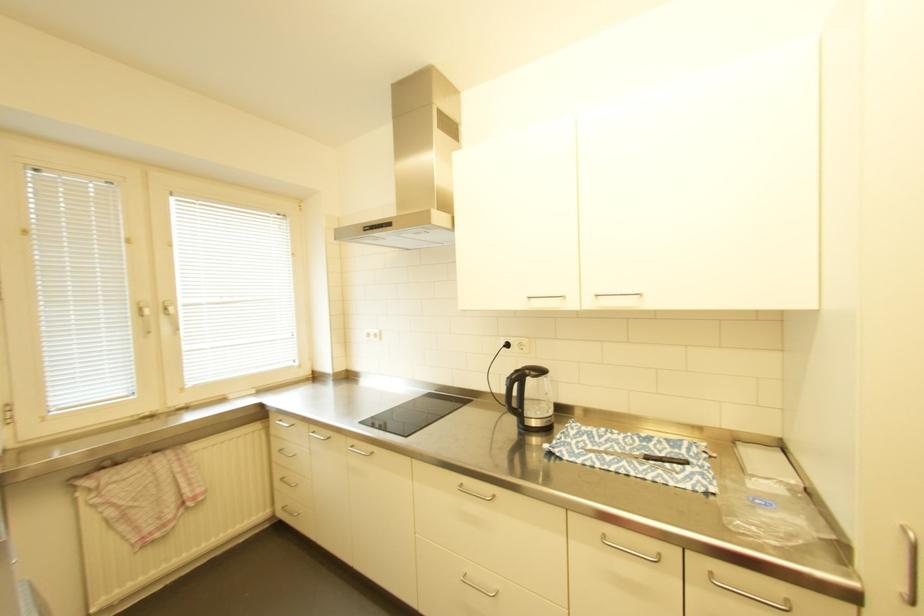
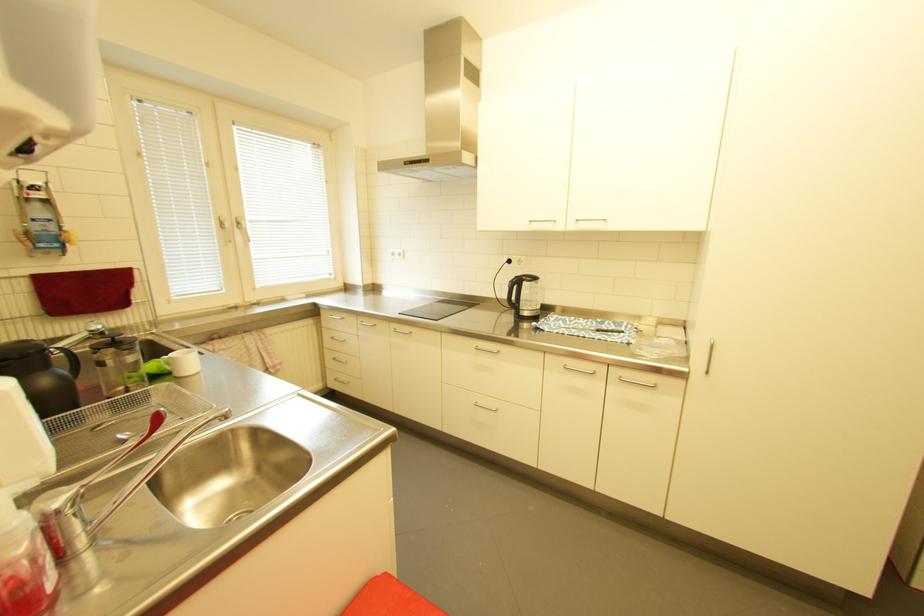
Question: The images are taken continuously from a first-person perspective. In which direction is your viewpoint rotating?

Choices:
 (A) Left
 (B) Right
 (C) Up
 (D) Down

Answer: (D)